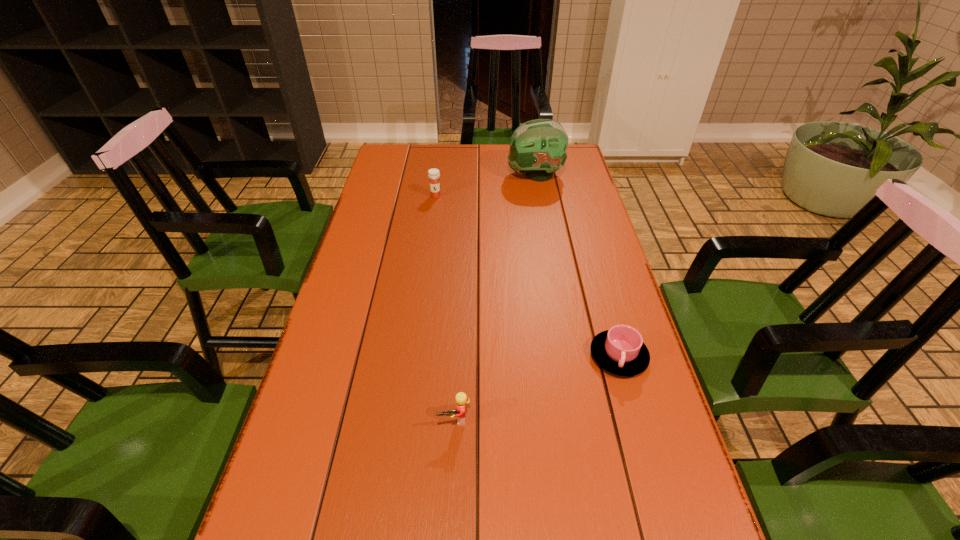
Where is `blank region between the tallest object and the Lego`? This screenshot has height=540, width=960. blank region between the tallest object and the Lego is located at coordinates (494, 297).

The width and height of the screenshot is (960, 540). In order to click on empty location between the farthest object and the leftmost object in this screenshot , I will do `click(486, 185)`.

Find the location of a particular element. the closest object to the leftmost object is located at coordinates (538, 147).

Find the location of a particular element. The height and width of the screenshot is (540, 960). object that can be found as the third closest to the farthest object is located at coordinates (461, 399).

This screenshot has height=540, width=960. What are the coordinates of `blank area in the image that satisfies the following two spatial constraints: 1. on the visor of the farthest object; 2. on the label side of the third nearest object` in the screenshot? It's located at (539, 196).

You are a GUI agent. You are given a task and a screenshot of the screen. Output one action in this format:
    pyautogui.click(x=<x>, y=<y>)
    Task: Click on the vacant space that satisfies the following two spatial constraints: 1. on the visor of the tallest object; 2. on the label side of the third nearest object
    Image resolution: width=960 pixels, height=540 pixels.
    Given the screenshot: What is the action you would take?
    pyautogui.click(x=539, y=196)

Locate an element on the screen. This screenshot has height=540, width=960. free space that satisfies the following two spatial constraints: 1. on the visor of the tallest object; 2. in front of the nearest object with the accessory visible is located at coordinates (579, 419).